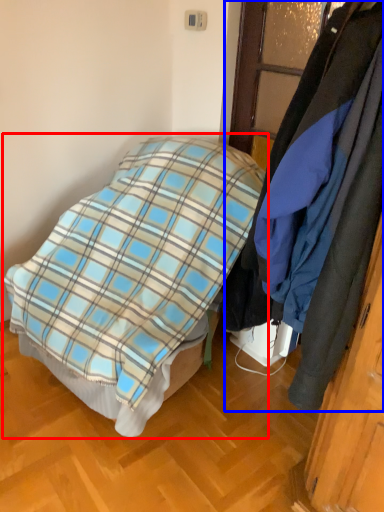
Question: Which object appears closest to the camera in this image, bed (highlighted by a red box) or cloak (highlighted by a blue box)?

Choices:
 (A) bed
 (B) cloak

Answer: (B)